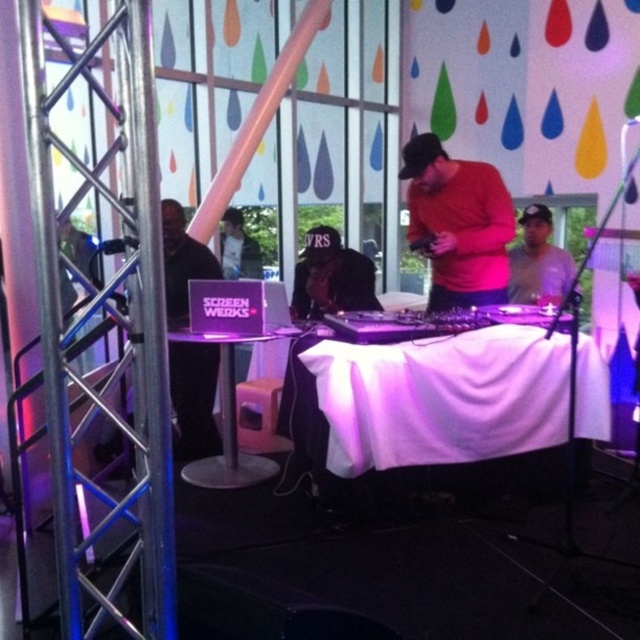
Question: Does black matte shirt at left appear over matte black headphones at center?

Choices:
 (A) no
 (B) yes

Answer: (A)

Question: Which object is farther from the camera taking this photo?

Choices:
 (A) gray matte shirt at center
 (B) black matte shirt at left
 (C) white cloth-covered table at center

Answer: (A)

Question: Which point is closer to the camera?

Choices:
 (A) gray matte shirt at center
 (B) matte black headphones at center
 (C) black matte shirt at left

Answer: (C)

Question: Is purple fabric-covered table at center above gray matte shirt at center?

Choices:
 (A) no
 (B) yes

Answer: (A)

Question: From the image, what is the correct spatial relationship of matte black headphones at center in relation to gray matte shirt at center?

Choices:
 (A) right
 (B) left

Answer: (B)

Question: Based on their relative distances, which object is nearer to the gray matte shirt at center?

Choices:
 (A) black matte shirt at left
 (B) white cloth-covered table at center
 (C) matte black headphones at center
 (D) purple fabric-covered table at center

Answer: (C)